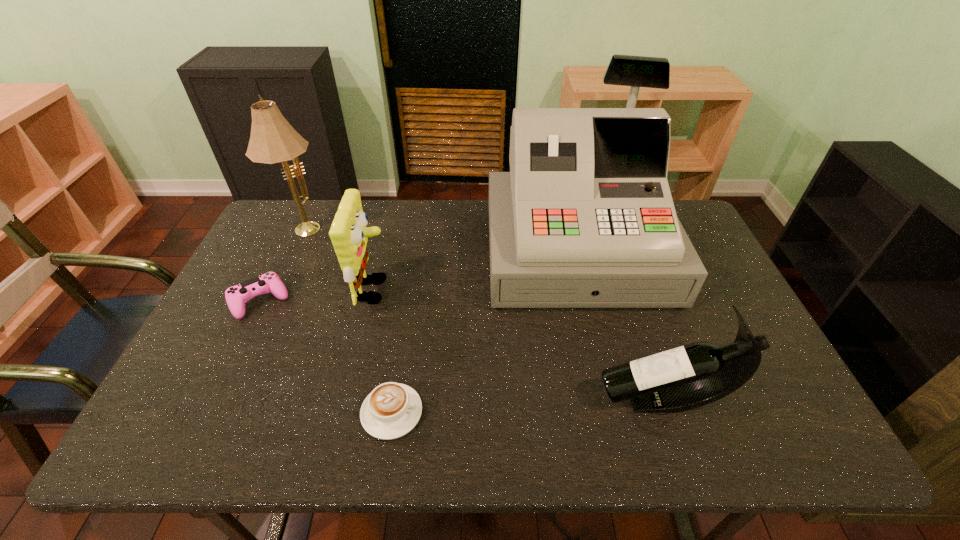
I want to click on empty space between the sponge and the cappuccino, so click(383, 351).

Point out which object is positioned as the third nearest to the cash register. Please provide its 2D coordinates. Your answer should be formatted as a tuple, i.e. [(x, y)], where the tuple contains the x and y coordinates of a point satisfying the conditions above.

[(348, 233)]

Identify the location of the third closest object to the sponge. The height and width of the screenshot is (540, 960). click(x=391, y=410).

Where is `free space that satisfies the following two spatial constraints: 1. on the keypad side of the cash register; 2. with the handle on the right side of the cappuccino`? free space that satisfies the following two spatial constraints: 1. on the keypad side of the cash register; 2. with the handle on the right side of the cappuccino is located at coordinates (614, 412).

I want to click on free location that satisfies the following two spatial constraints: 1. on the keypad side of the cash register; 2. with the handle on the right side of the cappuccino, so point(614,412).

I want to click on vacant space that satisfies the following two spatial constraints: 1. on the keypad side of the cash register; 2. on the face of the sponge, so click(586, 291).